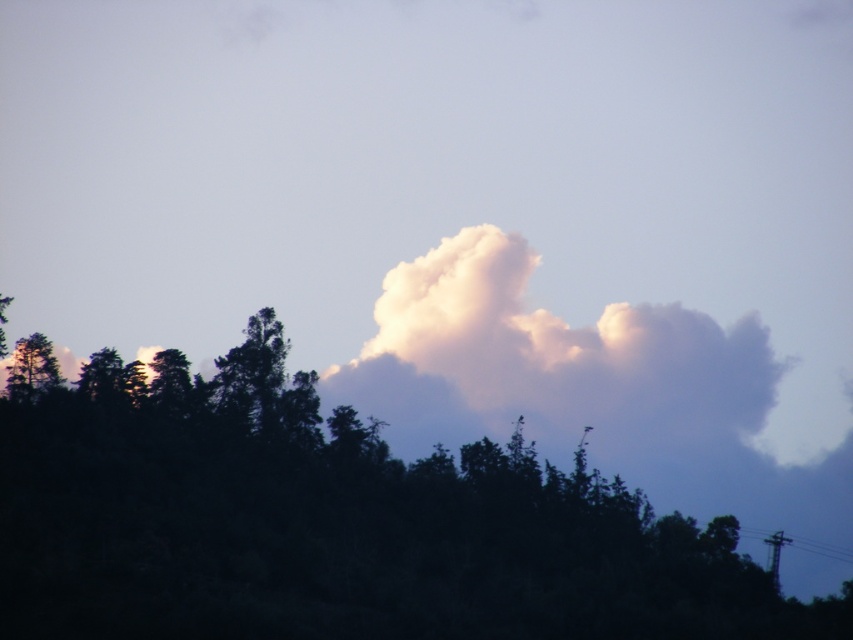
You are a photographer trying to capture the scene with a camera. The dark green foliage at upper center and the white fluffy cloud at upper center are both in your viewfinder. Given that your camera can only focus on objects within 50 meters, will both objects be in focus?

The dark green foliage at upper center is 55.67 meters away from the white fluffy cloud at upper center. Since the camera can only focus on objects within 50 meters, the distance between them exceeds the camera focus range. Therefore, both objects cannot be in focus simultaneously.